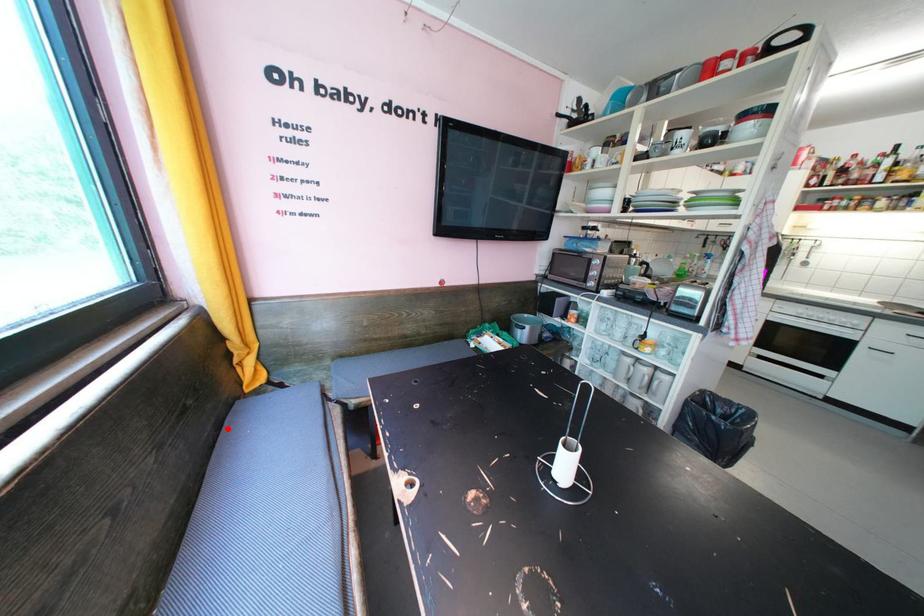
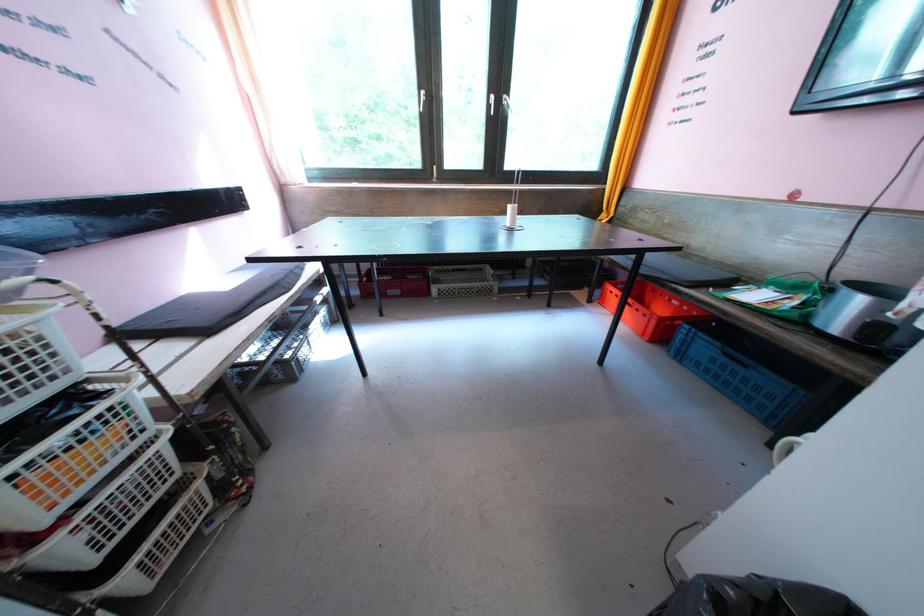
Question: I am providing you with two images of the same scene from different viewpoints. A red point is marked on the first image. Is the red point's position out of view in image 2?

Choices:
 (A) Yes
 (B) No

Answer: (A)